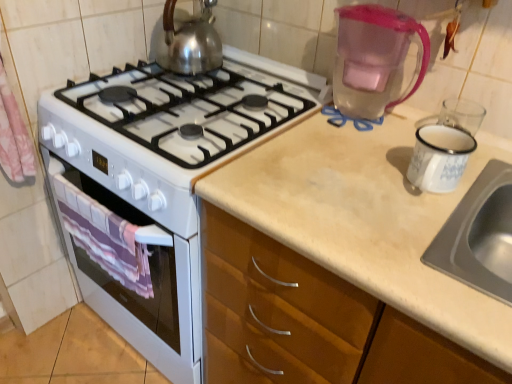
Question: Can you confirm if shiny metallic kettle at upper center is shorter than transparent plastic pitcher at upper right?

Choices:
 (A) yes
 (B) no

Answer: (A)

Question: Is shiny metallic kettle at upper center oriented away from transparent plastic pitcher at upper right?

Choices:
 (A) yes
 (B) no

Answer: (B)

Question: Could you tell me if shiny metallic kettle at upper center is facing transparent plastic pitcher at upper right?

Choices:
 (A) no
 (B) yes

Answer: (A)

Question: Considering the relative sizes of shiny metallic kettle at upper center and transparent plastic pitcher at upper right in the image provided, is shiny metallic kettle at upper center wider than transparent plastic pitcher at upper right?

Choices:
 (A) no
 (B) yes

Answer: (B)

Question: Is shiny metallic kettle at upper center bigger than transparent plastic pitcher at upper right?

Choices:
 (A) yes
 (B) no

Answer: (A)

Question: Visually, is purple striped towel at lower left positioned to the left or to the right of transparent plastic pitcher at upper right?

Choices:
 (A) right
 (B) left

Answer: (B)

Question: Is point (122, 238) closer or farther from the camera than point (378, 97)?

Choices:
 (A) closer
 (B) farther

Answer: (A)

Question: Considering their positions, is purple striped towel at lower left located in front of or behind transparent plastic pitcher at upper right?

Choices:
 (A) front
 (B) behind

Answer: (B)

Question: Do you think purple striped towel at lower left is within transparent plastic pitcher at upper right, or outside of it?

Choices:
 (A) inside
 (B) outside

Answer: (B)

Question: From the image's perspective, is shiny metallic kettle at upper center located above or below purple striped towel at lower left?

Choices:
 (A) above
 (B) below

Answer: (A)

Question: Is point (202, 49) closer or farther from the camera than point (65, 208)?

Choices:
 (A) farther
 (B) closer

Answer: (A)

Question: From a real-world perspective, is shiny metallic kettle at upper center above or below purple striped towel at lower left?

Choices:
 (A) above
 (B) below

Answer: (A)

Question: Considering the positions of shiny metallic kettle at upper center and purple striped towel at lower left in the image, is shiny metallic kettle at upper center bigger or smaller than purple striped towel at lower left?

Choices:
 (A) big
 (B) small

Answer: (A)

Question: Is transparent plastic pitcher at upper right situated inside purple striped towel at lower left or outside?

Choices:
 (A) inside
 (B) outside

Answer: (B)

Question: From the image's perspective, relative to purple striped towel at lower left, is transparent plastic pitcher at upper right above or below?

Choices:
 (A) below
 (B) above

Answer: (B)